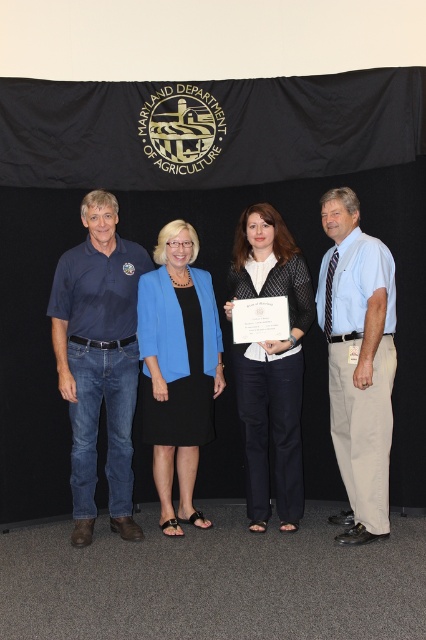
Is blue fabric jacket at center positioned in front of black textured sweater at center?

That is False.

Locate an element on the screen. This screenshot has height=640, width=426. blue fabric jacket at center is located at coordinates (178, 365).

Is matte blue shirt at left below light blue shirt at center?

Indeed, matte blue shirt at left is positioned under light blue shirt at center.

Describe the element at coordinates (98, 358) in the screenshot. The height and width of the screenshot is (640, 426). I see `matte blue shirt at left` at that location.

Find the location of a particular element. The width and height of the screenshot is (426, 640). matte blue shirt at left is located at coordinates (98, 358).

Identify the location of matte blue shirt at left. The image size is (426, 640). (98, 358).

Describe the element at coordinates (98, 358) in the screenshot. I see `matte blue shirt at left` at that location.

Does matte blue shirt at left appear under black textured sweater at center?

No, matte blue shirt at left is not below black textured sweater at center.

Find the location of a particular element. The width and height of the screenshot is (426, 640). matte blue shirt at left is located at coordinates (98, 358).